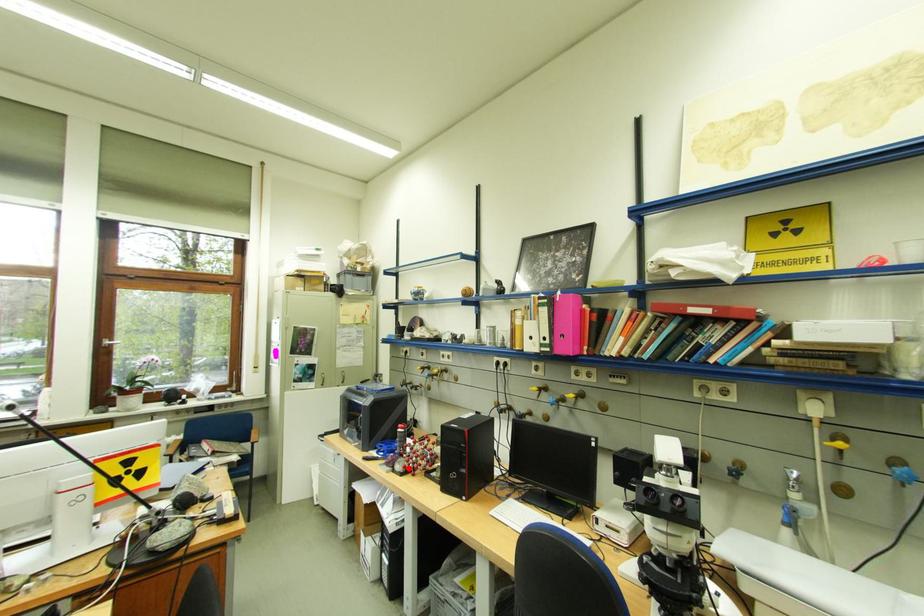
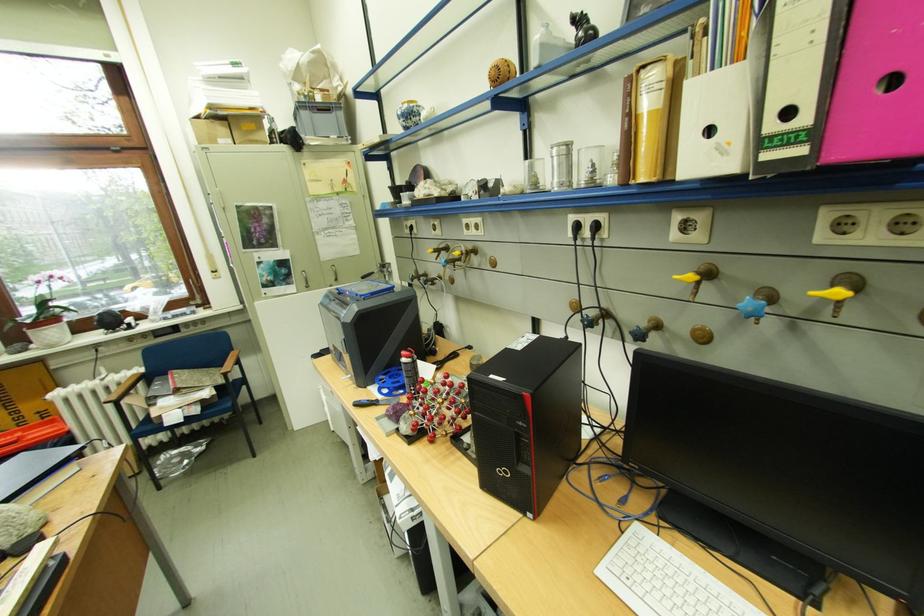
Find the pixel in the second image that matches the highlighted location in the first image.

(415, 429)